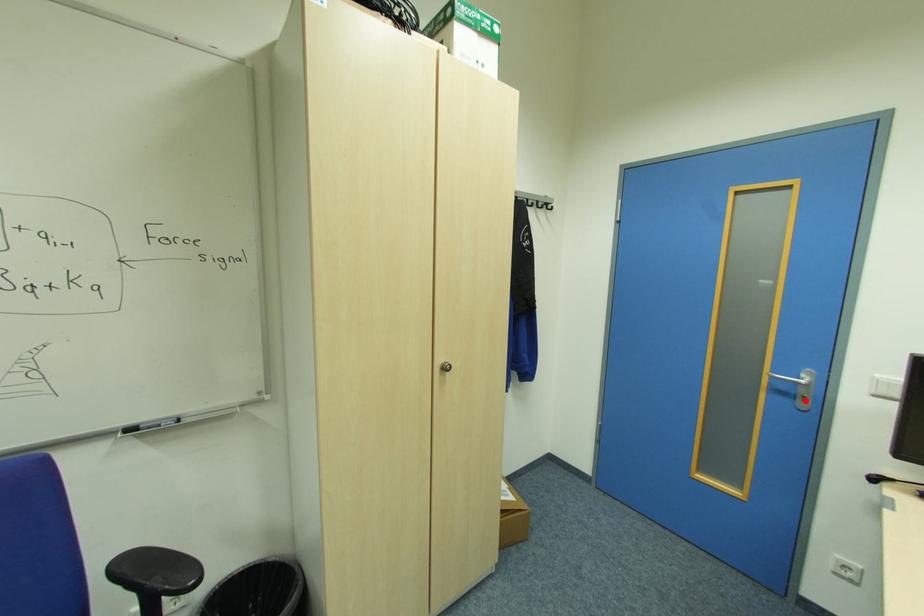
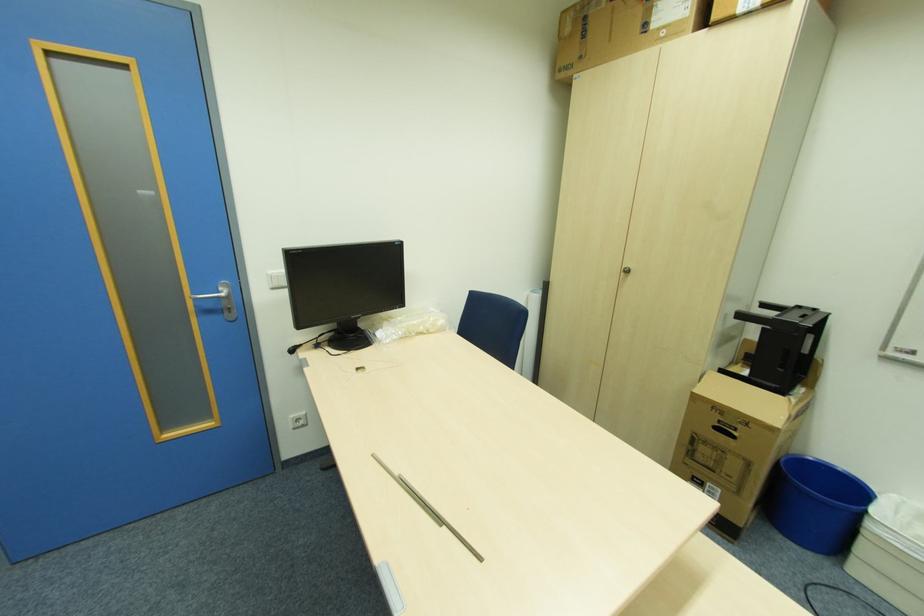
Find the pixel in the second image that matches the highlighted location in the first image.

(234, 310)